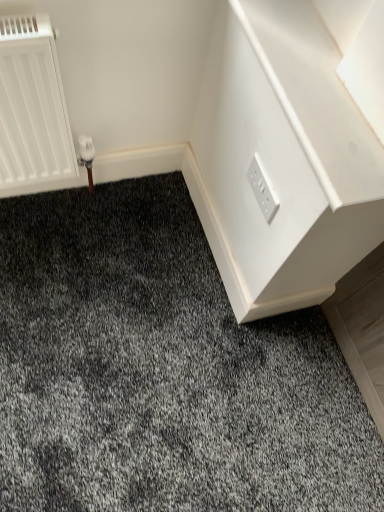
At what (x,y) coordinates should I click in order to perform the action: click on white plastic power plugs and sockets at upper right. Please return your answer as a coordinate pair (x, y). Looking at the image, I should click on (262, 188).

Image resolution: width=384 pixels, height=512 pixels. Describe the element at coordinates (262, 188) in the screenshot. I see `white plastic power plugs and sockets at upper right` at that location.

What do you see at coordinates (283, 158) in the screenshot?
I see `white glossy dresser at upper right` at bounding box center [283, 158].

This screenshot has height=512, width=384. What are the coordinates of `white glossy dresser at upper right` in the screenshot? It's located at (283, 158).

This screenshot has width=384, height=512. In order to click on white plastic power plugs and sockets at upper right in this screenshot , I will do `click(262, 188)`.

Does white plastic power plugs and sockets at upper right appear on the right side of white glossy dresser at upper right?

No.

Is the position of white plastic power plugs and sockets at upper right more distant than that of white glossy dresser at upper right?

Yes, the depth of white plastic power plugs and sockets at upper right is greater than that of white glossy dresser at upper right.

Is point (261, 177) farther from camera compared to point (205, 219)?

No.

From the image's perspective, is white plastic power plugs and sockets at upper right located above or below white glossy dresser at upper right?

Clearly, from the image's perspective, white plastic power plugs and sockets at upper right is below white glossy dresser at upper right.

Looking at this image, from a real-world perspective, is white plastic power plugs and sockets at upper right on white glossy dresser at upper right?

Actually, white plastic power plugs and sockets at upper right is physically below white glossy dresser at upper right in the real world.

Which of these two, white plastic power plugs and sockets at upper right or white glossy dresser at upper right, is wider?

white glossy dresser at upper right is wider.

Can you confirm if white plastic power plugs and sockets at upper right is shorter than white glossy dresser at upper right?

In fact, white plastic power plugs and sockets at upper right may be taller than white glossy dresser at upper right.

From the picture: Can you confirm if white plastic power plugs and sockets at upper right is bigger than white glossy dresser at upper right?

Incorrect, white plastic power plugs and sockets at upper right is not larger than white glossy dresser at upper right.

Is white plastic power plugs and sockets at upper right situated inside white glossy dresser at upper right or outside?

white plastic power plugs and sockets at upper right cannot be found inside white glossy dresser at upper right.

Is white plastic power plugs and sockets at upper right placed right next to white glossy dresser at upper right?

white plastic power plugs and sockets at upper right is not next to white glossy dresser at upper right, and they're not touching.

Looking at this image, is white plastic power plugs and sockets at upper right looking in the opposite direction of white glossy dresser at upper right?

That's not correct — white plastic power plugs and sockets at upper right is not looking away from white glossy dresser at upper right.

Locate an element on the screen. This screenshot has width=384, height=512. dresser that appears on the right of white plastic power plugs and sockets at upper right is located at coordinates (283, 158).

Which is more to the right, white glossy dresser at upper right or white plastic power plugs and sockets at upper right?

Positioned to the right is white glossy dresser at upper right.

In the image, is white glossy dresser at upper right positioned in front of or behind white plastic power plugs and sockets at upper right?

Visually, white glossy dresser at upper right is located in front of white plastic power plugs and sockets at upper right.

From the picture: Which is less distant, (278,47) or (263,181)?

Point (278,47) is closer to the camera than point (263,181).

Consider the image. From the image's perspective, which object appears higher, white glossy dresser at upper right or white plastic power plugs and sockets at upper right?

white glossy dresser at upper right, from the image's perspective.

From a real-world perspective, is white glossy dresser at upper right on white plastic power plugs and sockets at upper right?

Indeed, from a real-world perspective, white glossy dresser at upper right stands above white plastic power plugs and sockets at upper right.

Which object is wider, white glossy dresser at upper right or white plastic power plugs and sockets at upper right?

Wider between the two is white glossy dresser at upper right.

From their relative heights in the image, would you say white glossy dresser at upper right is taller or shorter than white plastic power plugs and sockets at upper right?

In the image, white glossy dresser at upper right appears to be shorter than white plastic power plugs and sockets at upper right.

Is white glossy dresser at upper right bigger or smaller than white plastic power plugs and sockets at upper right?

In the image, white glossy dresser at upper right appears to be larger than white plastic power plugs and sockets at upper right.

Is white glossy dresser at upper right inside or outside of white plastic power plugs and sockets at upper right?

white glossy dresser at upper right exists outside the volume of white plastic power plugs and sockets at upper right.

Is white glossy dresser at upper right beside white plastic power plugs and sockets at upper right?

No, white glossy dresser at upper right is not making contact with white plastic power plugs and sockets at upper right.

Is white glossy dresser at upper right facing towards white plastic power plugs and sockets at upper right?

No.

Can you tell me how much white glossy dresser at upper right and white plastic power plugs and sockets at upper right differ in facing direction?

The angle between the facing direction of white glossy dresser at upper right and the facing direction of white plastic power plugs and sockets at upper right is 0.692 degrees.

In the image, there is a white glossy dresser at upper right. In order to click on power plugs and sockets below it (from the image's perspective) in this screenshot , I will do `click(262, 188)`.

Where is `power plugs and sockets behind the white glossy dresser at upper right`? power plugs and sockets behind the white glossy dresser at upper right is located at coordinates (262, 188).

Locate an element on the screen. The height and width of the screenshot is (512, 384). power plugs and sockets that is below the white glossy dresser at upper right (from the image's perspective) is located at coordinates (x=262, y=188).